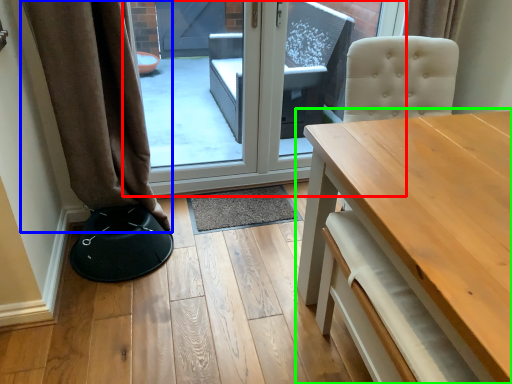
Question: Estimate the real-world distances between objects in this image. Which object is closer to door (highlighted by a red box), curtain (highlighted by a blue box) or table (highlighted by a green box)?

Choices:
 (A) curtain
 (B) table

Answer: (A)